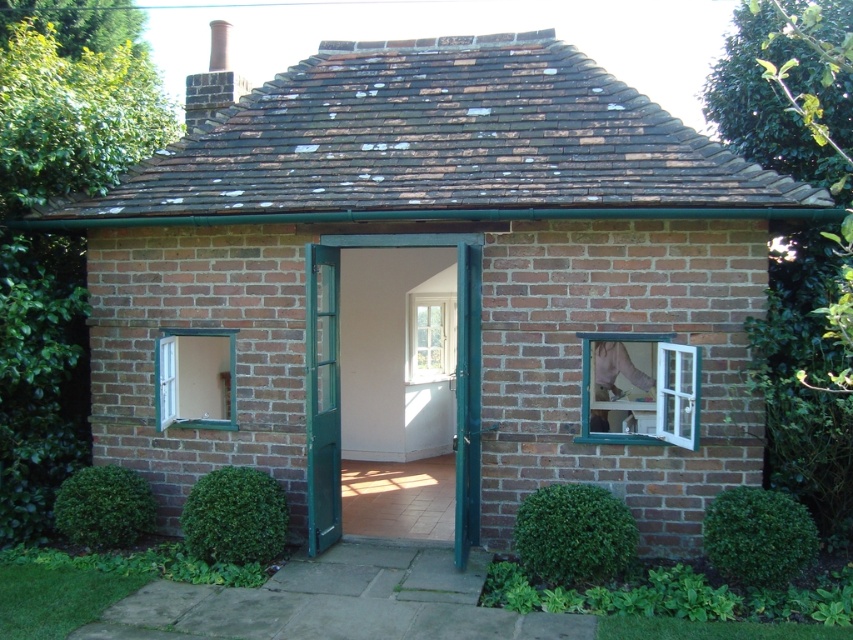
Is the position of green leafy hedge at lower center more distant than that of green leafy bush at lower right?

That is True.

Is point (613, 504) in front of point (769, 561)?

No, it is not.

Who is more forward, (592, 538) or (722, 563)?

Positioned in front is point (722, 563).

Locate an element on the screen. The height and width of the screenshot is (640, 853). green leafy hedge at lower center is located at coordinates (573, 534).

Who is shorter, green leafy hedge at lower center or green leafy bush at lower left?

green leafy bush at lower left is shorter.

Who is positioned more to the left, green leafy hedge at lower center or green leafy bush at lower left?

green leafy bush at lower left

At what (x,y) coordinates should I click in order to perform the action: click on green leafy hedge at lower center. Please return your answer as a coordinate pair (x, y). Looking at the image, I should click on point(573,534).

Between green wood window at lower left and green leafy bush at lower left, which one has less height?

With less height is green leafy bush at lower left.

Where is `green wood window at lower left`? The image size is (853, 640). green wood window at lower left is located at coordinates (195, 378).

This screenshot has height=640, width=853. Find the location of `green wood window at lower left`. green wood window at lower left is located at coordinates (195, 378).